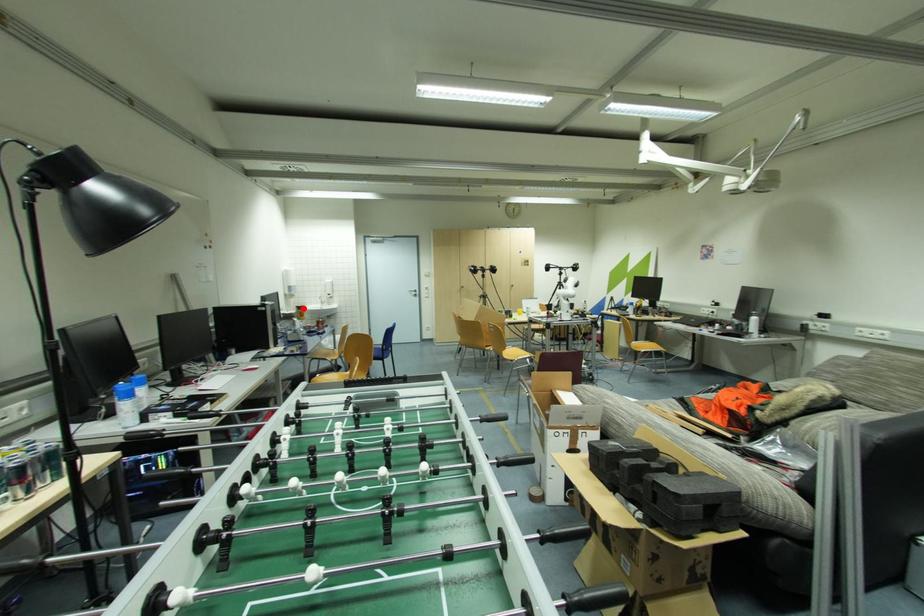
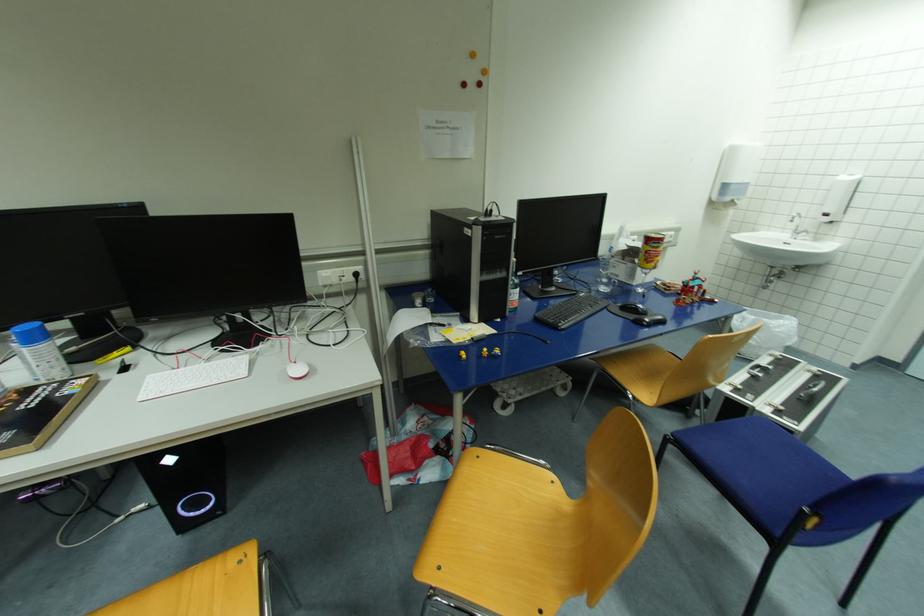
Locate, in the second image, the point that corresponds to the highlighted location in the first image.

(653, 241)